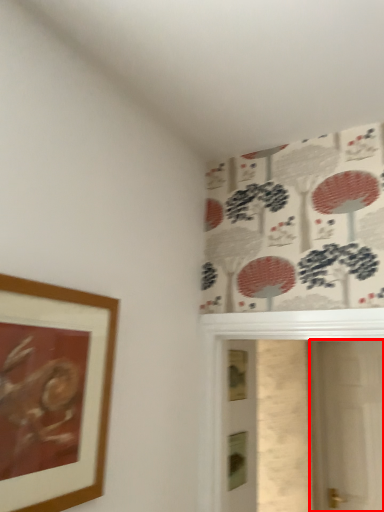
Question: From the image's perspective, considering the relative positions of screen door (annotated by the red box) and picture frame in the image provided, where is screen door (annotated by the red box) located with respect to the staircase?

Choices:
 (A) above
 (B) below

Answer: (B)